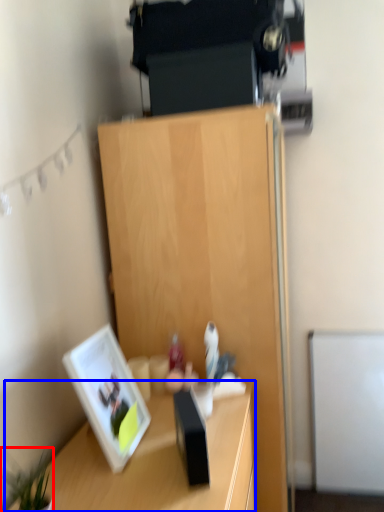
Question: Which of the following is the closest to the observer, plant (highlighted by a red box) or desk (highlighted by a blue box)?

Choices:
 (A) plant
 (B) desk

Answer: (A)